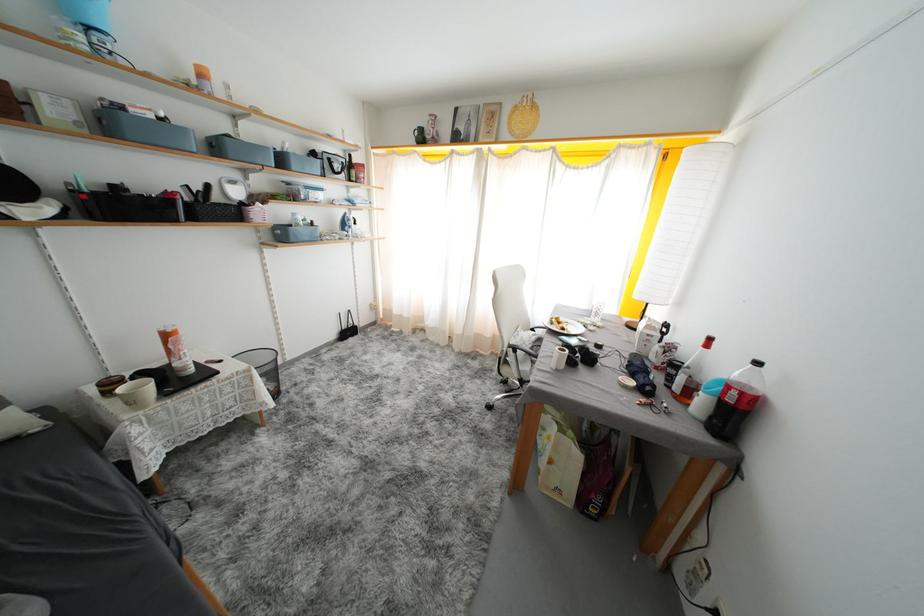
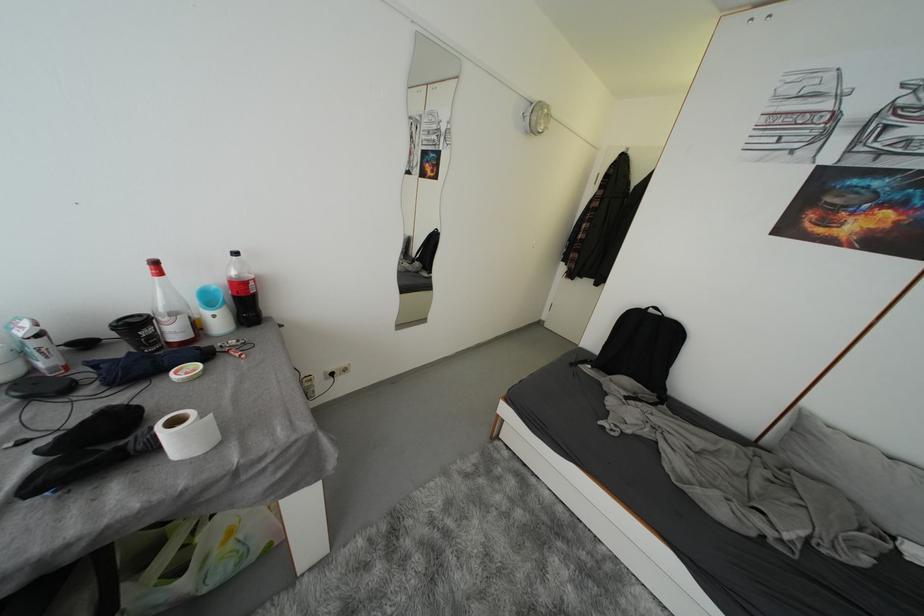
The point at [676,382] is marked in the first image. Where is the corresponding point in the second image?

(162, 342)